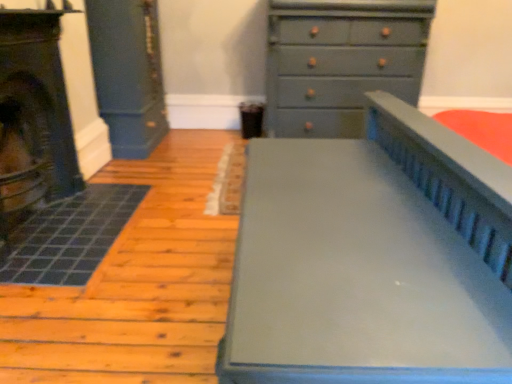
Where is `vacant area on top of matte gray bed at center (from a real-world perspective)`? This screenshot has height=384, width=512. vacant area on top of matte gray bed at center (from a real-world perspective) is located at coordinates (349, 241).